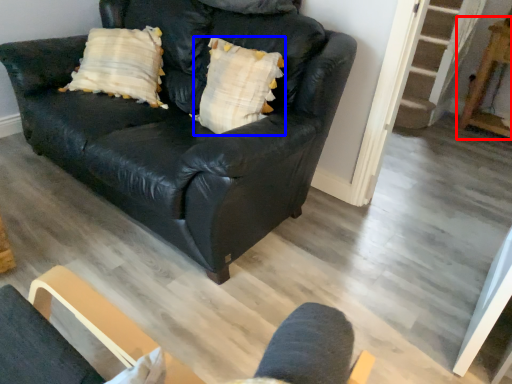
Question: Among these objects, which one is farthest to the camera, table (highlighted by a red box) or pillow (highlighted by a blue box)?

Choices:
 (A) table
 (B) pillow

Answer: (A)